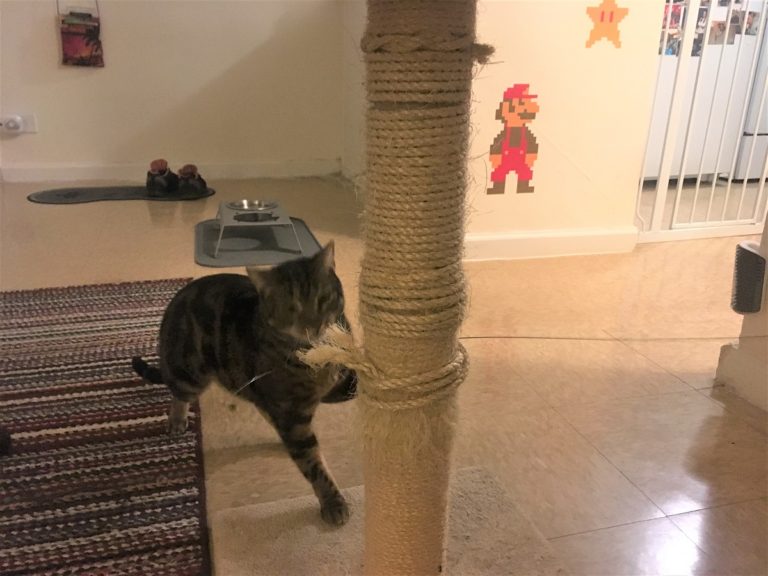
Where is `corner`? corner is located at coordinates tap(730, 363), tap(627, 238), tap(329, 158).